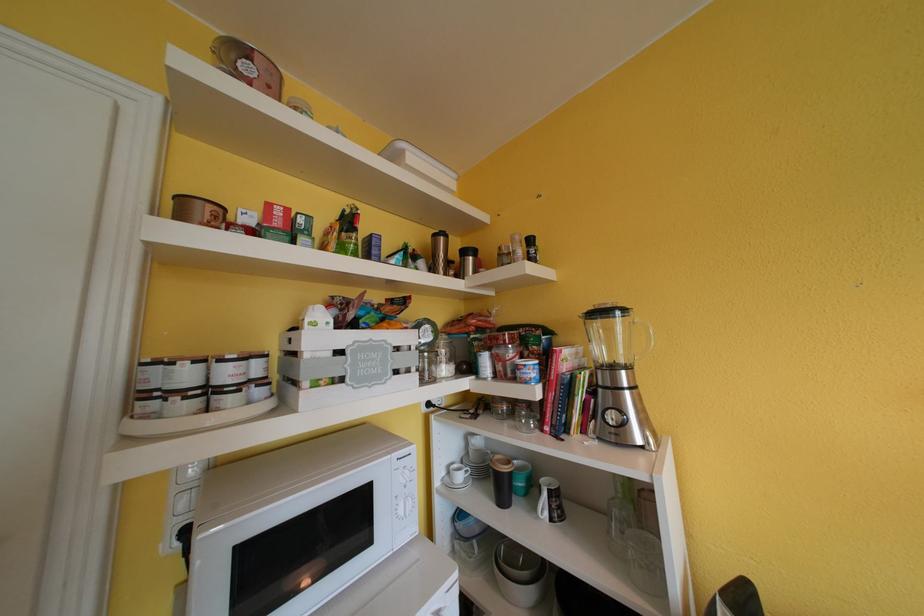
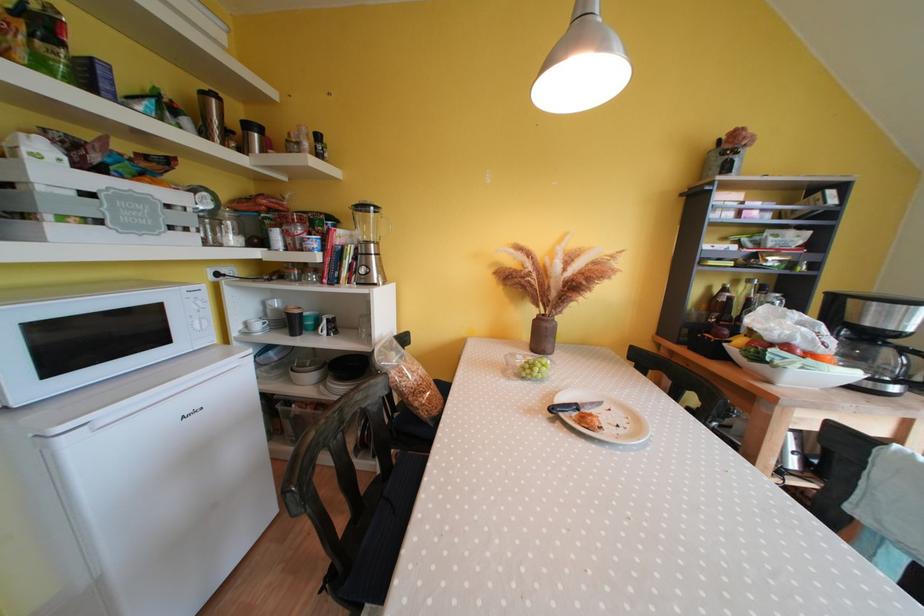
Where in the second image is the point corresponding to point 419,362 from the first image?

(196, 224)